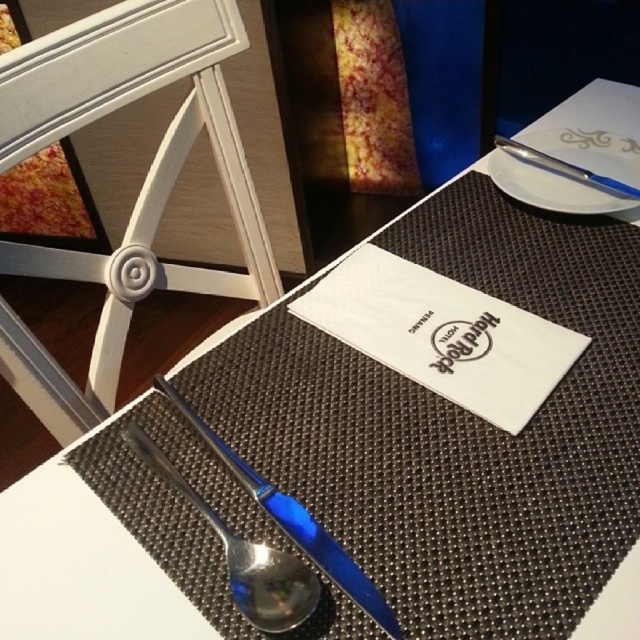
Question: Is white wood chair at upper left closer to the viewer compared to shiny metal pen at upper right?

Choices:
 (A) yes
 (B) no

Answer: (A)

Question: From the image, what is the correct spatial relationship of white wood chair at upper left in relation to shiny metal pen at upper right?

Choices:
 (A) left
 (B) right

Answer: (A)

Question: Does blue polished spoon at center lie behind shiny metal pen at upper right?

Choices:
 (A) no
 (B) yes

Answer: (A)

Question: Which is nearer to the shiny metal pen at upper right?

Choices:
 (A) blue plastic spoon at center
 (B) blue polished spoon at center
 (C) white wood chair at upper left

Answer: (B)

Question: Which object appears farthest from the camera in this image?

Choices:
 (A) blue polished spoon at center
 (B) shiny metal pen at upper right
 (C) blue plastic spoon at center
 (D) white wood chair at upper left

Answer: (B)

Question: Which object is positioned closest to the shiny metal pen at upper right?

Choices:
 (A) blue polished spoon at center
 (B) blue plastic spoon at center

Answer: (A)